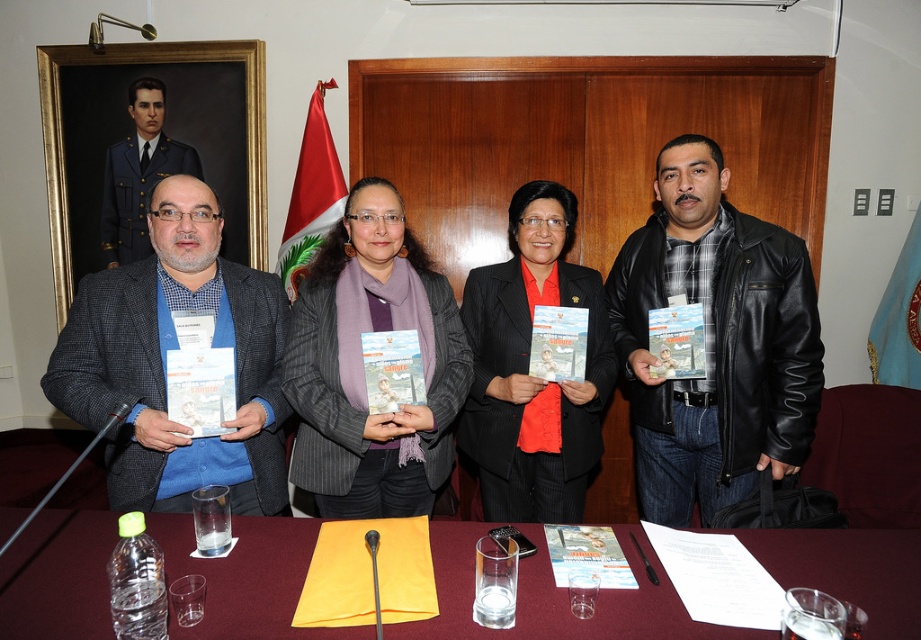
You are an event photographer at the conference. You need to capture a photo of the black leather jacket at right and the matte blue shirt at left. According to the scene description, which object is covering part of the other?

The black leather jacket at right is positioned over the matte blue shirt at left, so it is covering part of it.

You are standing in front of the maroon fabric table at center and the matte blue shirt at left. Which object is positioned to the left?

The matte blue shirt at left is positioned to the left of the maroon fabric table at center.

You are standing in front of the table at the formal event. You need to place a small object on the table between the two points labeled point (735, 410) and point (327, 497). Which point should you aim for if you want the object to be closer to the camera?

You should aim for point (735, 410) because it is further to the camera than point (327, 497).